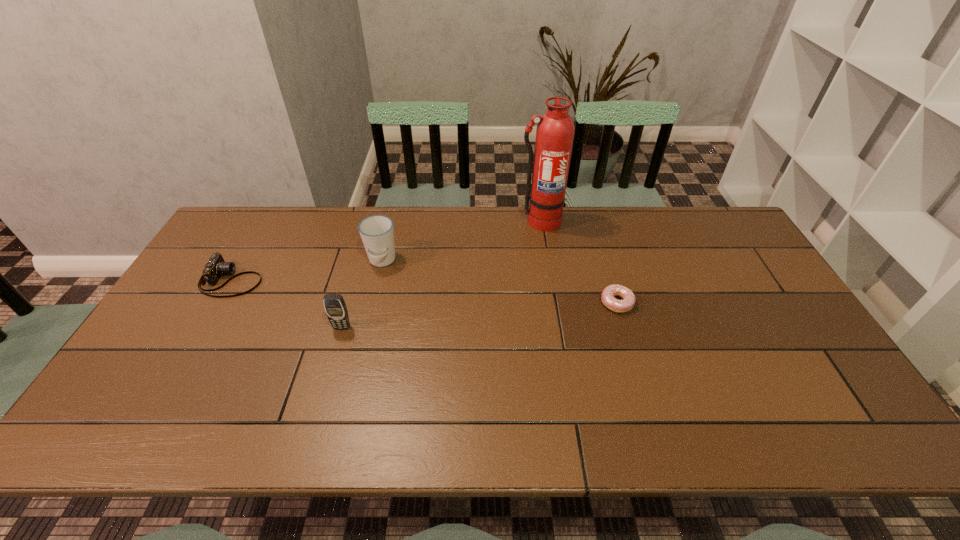
What are the coordinates of `free space located on the front face of the cellular telephone` in the screenshot? It's located at (335, 352).

The image size is (960, 540). Identify the location of free space located 0.180m on the front-facing side of the camera. (322, 280).

Locate an element on the screen. This screenshot has width=960, height=540. vacant area situated 0.220m on the front of the rightmost object is located at coordinates (641, 384).

Locate an element on the screen. fire extinguisher located in the far edge section of the desktop is located at coordinates (555, 131).

Find the location of a particular element. The height and width of the screenshot is (540, 960). cup present at the far edge is located at coordinates (377, 232).

At what (x,y) coordinates should I click in order to perform the action: click on object located at the left edge. Please return your answer as a coordinate pair (x, y). The image size is (960, 540). Looking at the image, I should click on (216, 267).

I want to click on free location at the far edge, so click(605, 208).

You are a GUI agent. You are given a task and a screenshot of the screen. Output one action in this format:
    pyautogui.click(x=<x>, y=<y>)
    Task: Click on the vacant area at the near edge
    This screenshot has height=540, width=960.
    Given the screenshot: What is the action you would take?
    pyautogui.click(x=611, y=409)

At what (x,y) coordinates should I click in order to perform the action: click on vacant space at the left edge of the desktop. Please return your answer as a coordinate pair (x, y). The image size is (960, 540). Looking at the image, I should click on (237, 269).

Image resolution: width=960 pixels, height=540 pixels. In order to click on vacant space at the far left corner in this screenshot , I will do `click(254, 245)`.